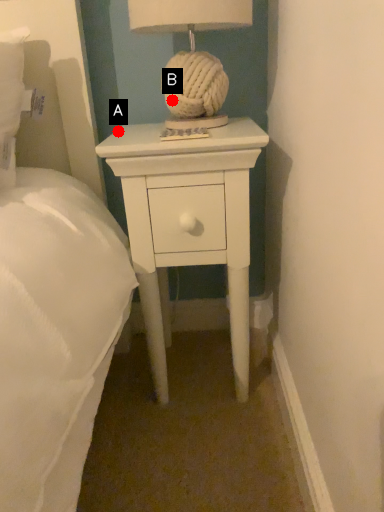
Question: Two points are circled on the image, labeled by A and B beside each circle. Which point is farther from the camera taking this photo?

Choices:
 (A) A is further
 (B) B is further

Answer: (A)